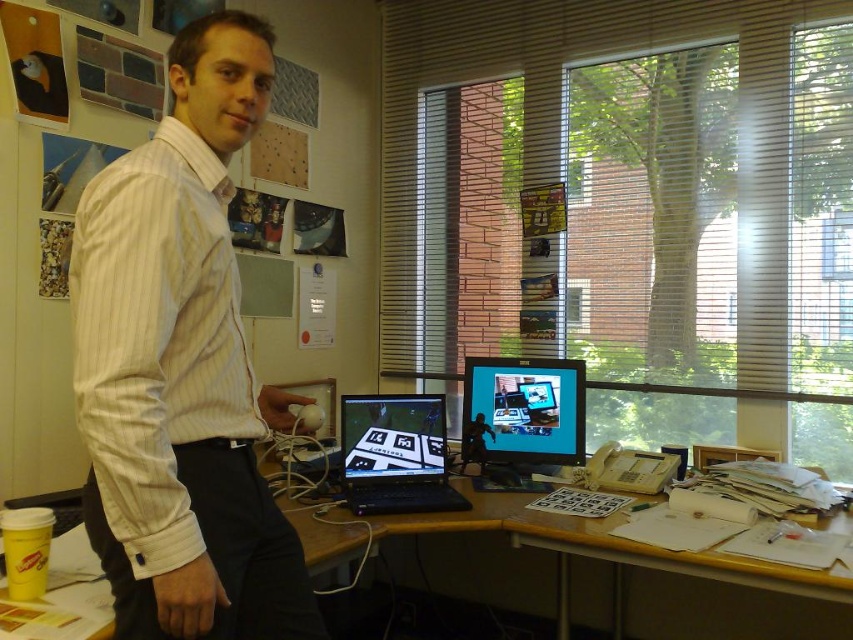
You are organizing a photoshoot and need to ensure that the white striped shirt at center and the black glossy laptop at center are both visible in the frame. Given their sizes, which object might require more careful positioning to avoid being obscured?

The white striped shirt at center has a lesser width compared to the black glossy laptop at center, so it might require more careful positioning to avoid being obscured since it is smaller in width.

You are a delivery person who needs to place a package on the desk. The package must be placed exactly at the coordinates where the matte black computer monitor at center is located. Can you confirm the coordinates for placement?

The coordinates for placing the package should be at point [523,412] where the matte black computer monitor at center is located.

From the picture: You are organizing a desk and see the white striped shirt at center and the white paper at lower right. Which item is located to the left of the other?

The white striped shirt at center is positioned on the left side of white paper at lower right.